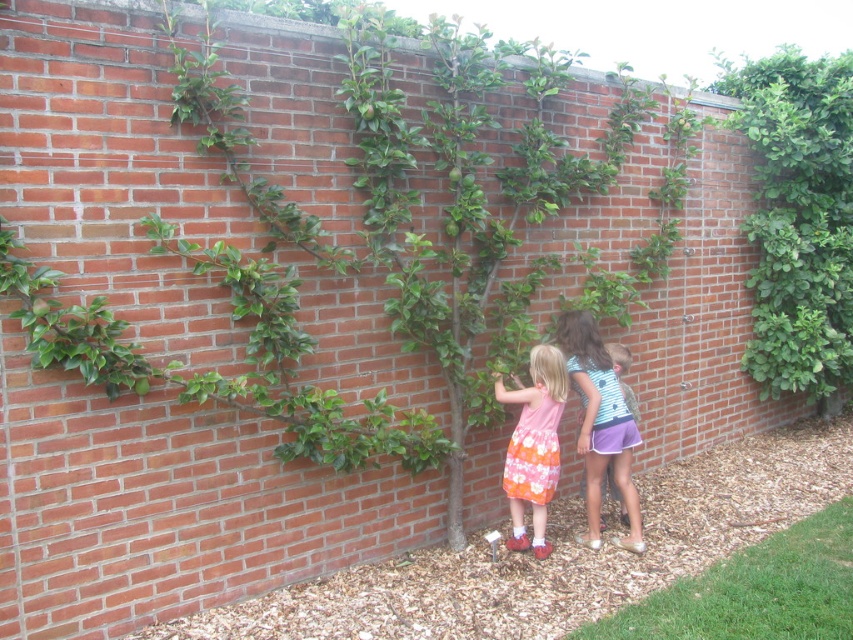
The image size is (853, 640). Describe the element at coordinates (601, 424) in the screenshot. I see `striped cotton shirt at center` at that location.

Between striped cotton shirt at center and floral cotton dress at center, which one appears on the right side from the viewer's perspective?

striped cotton shirt at center

Locate an element on the screen. striped cotton shirt at center is located at coordinates (601, 424).

Does green leafy bush at upper right have a lesser width compared to striped cotton shirt at center?

In fact, green leafy bush at upper right might be wider than striped cotton shirt at center.

Does green leafy bush at upper right appear on the left side of striped cotton shirt at center?

Incorrect, green leafy bush at upper right is not on the left side of striped cotton shirt at center.

Find the location of a particular element. Image resolution: width=853 pixels, height=640 pixels. green leafy bush at upper right is located at coordinates (798, 218).

Which of these two, green leafy bush at upper right or floral cotton dress at center, stands taller?

Standing taller between the two is green leafy bush at upper right.

This screenshot has width=853, height=640. Describe the element at coordinates (798, 218) in the screenshot. I see `green leafy bush at upper right` at that location.

Which is behind, point (820, 72) or point (534, 406)?

The point (820, 72) is more distant.

Where is `green leafy bush at upper right`? green leafy bush at upper right is located at coordinates 798,218.